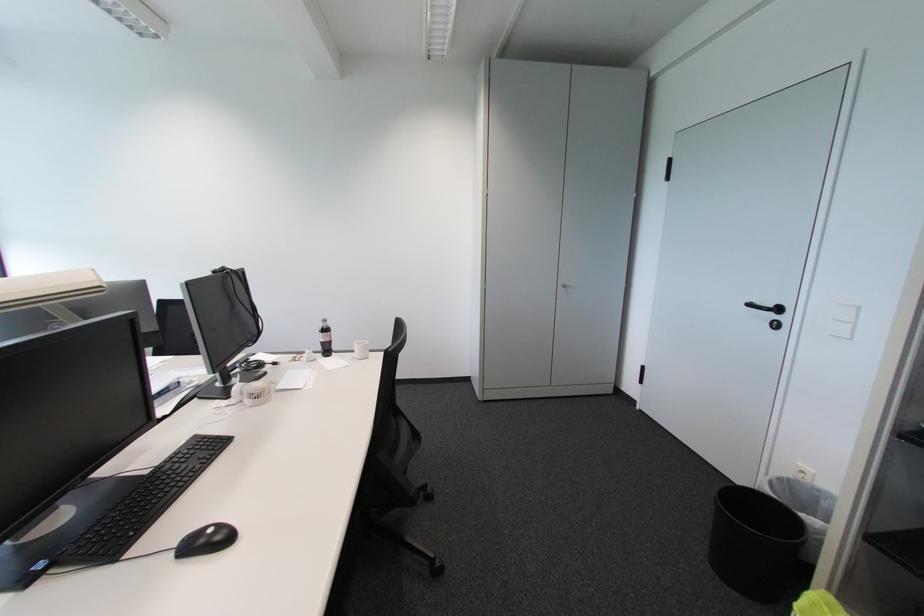
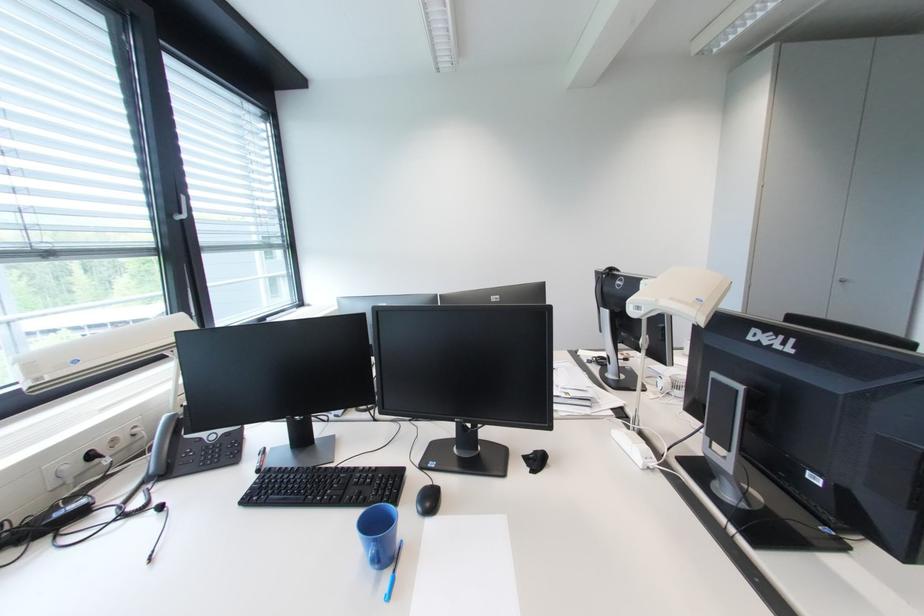
Locate, in the second image, the point that corresponds to (x=567, y=290) in the first image.

(844, 285)